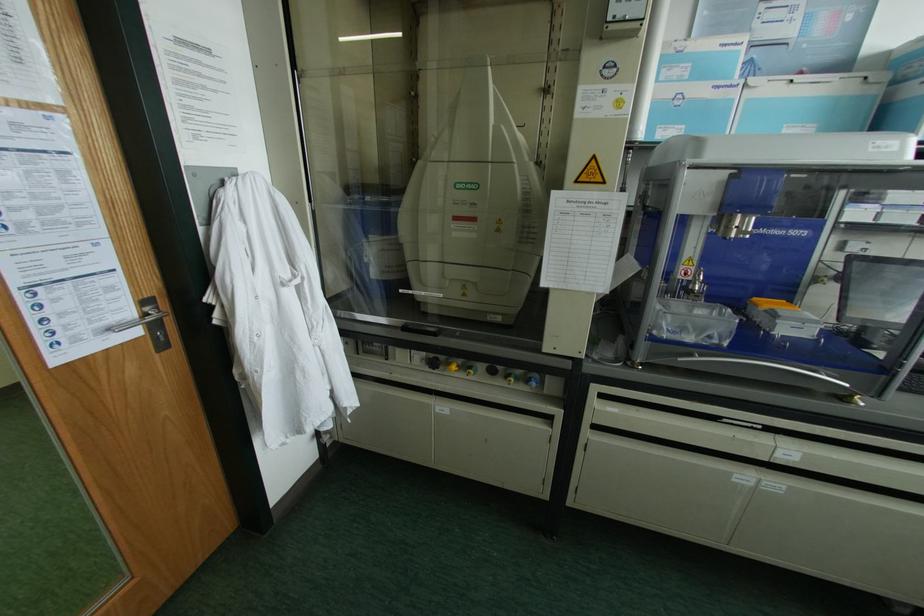
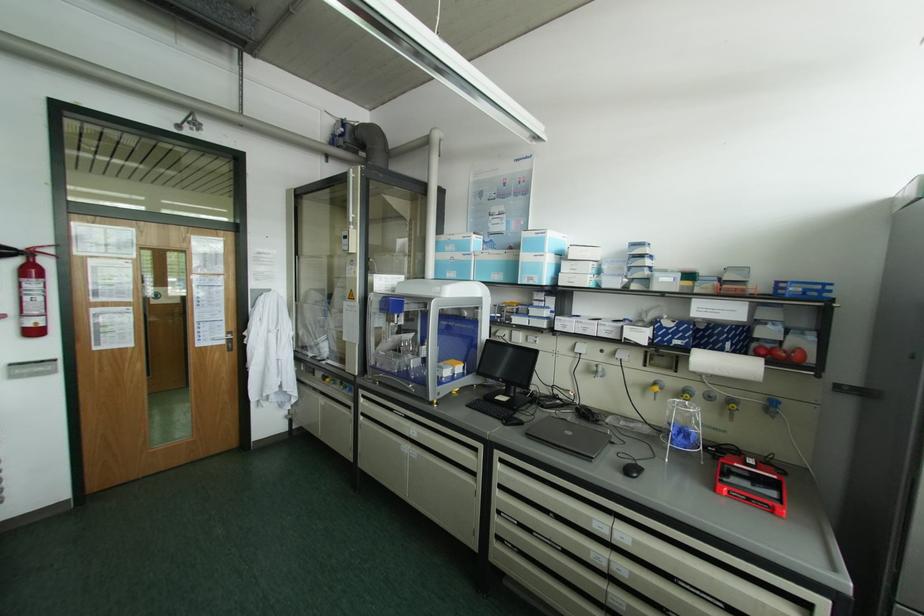
Where in the second image is the point corresponding to point 699,90 from the first image?

(457, 256)